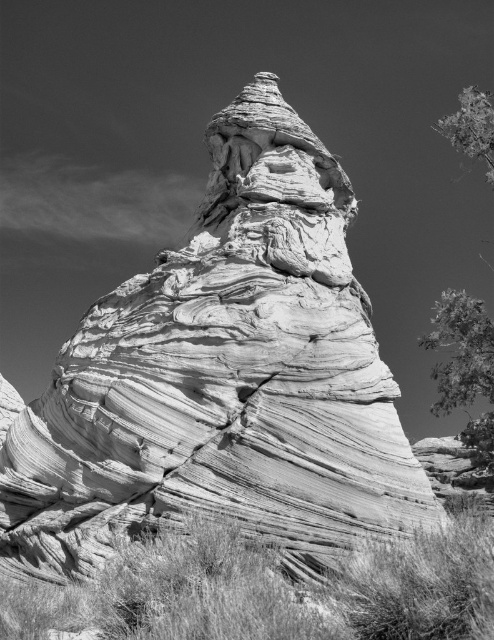
You are standing in front of the rock formation and want to touch the two points on it. Which point is closer to you, point at coordinates [468,97] or point at coordinates [484,141]?

Point at coordinates [468,97] is closer to you than point at coordinates [484,141].

You are an artist trying to sketch this scene. You notice the green leafy tree at upper right and the smooth green leaves at upper right. Which object is narrower in width?

The green leafy tree at upper right is narrower in width compared to the smooth green leaves at upper right.